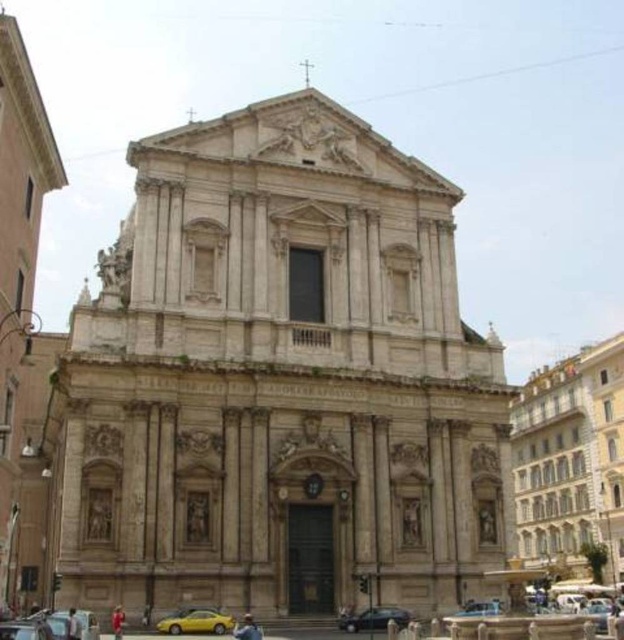
Question: Can you confirm if marble building at right is wider than yellow metallic car at lower left?

Choices:
 (A) no
 (B) yes

Answer: (B)

Question: Estimate the real-world distances between objects in this image. Which object is closer to the shiny black sedan at lower center?

Choices:
 (A) marble building at right
 (B) yellow metallic car at lower left

Answer: (B)

Question: Does marble building at right have a lesser width compared to yellow metallic car at lower left?

Choices:
 (A) no
 (B) yes

Answer: (A)

Question: Does yellow matte car at lower center appear on the right side of silver metallic car at center?

Choices:
 (A) no
 (B) yes

Answer: (A)

Question: Among these objects, which one is nearest to the camera?

Choices:
 (A) shiny black sedan at lower center
 (B) silver metallic car at center
 (C) marble building at right

Answer: (A)

Question: Considering the real-world distances, which object is closest to the marble building at right?

Choices:
 (A) shiny black sedan at lower center
 (B) yellow matte car at lower center
 (C) beige stone church at center

Answer: (C)